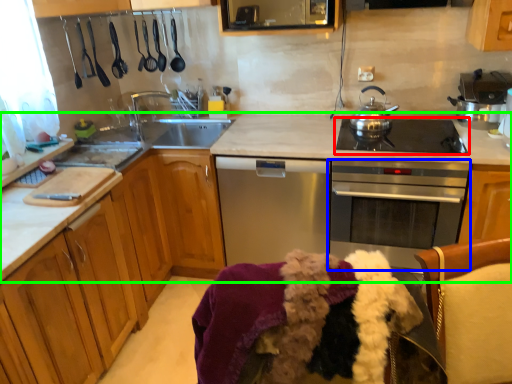
Question: Considering the real-world distances, which object is farthest from gas stove (highlighted by a red box)? oven (highlighted by a blue box) or countertop (highlighted by a green box)?

Choices:
 (A) oven
 (B) countertop

Answer: (A)